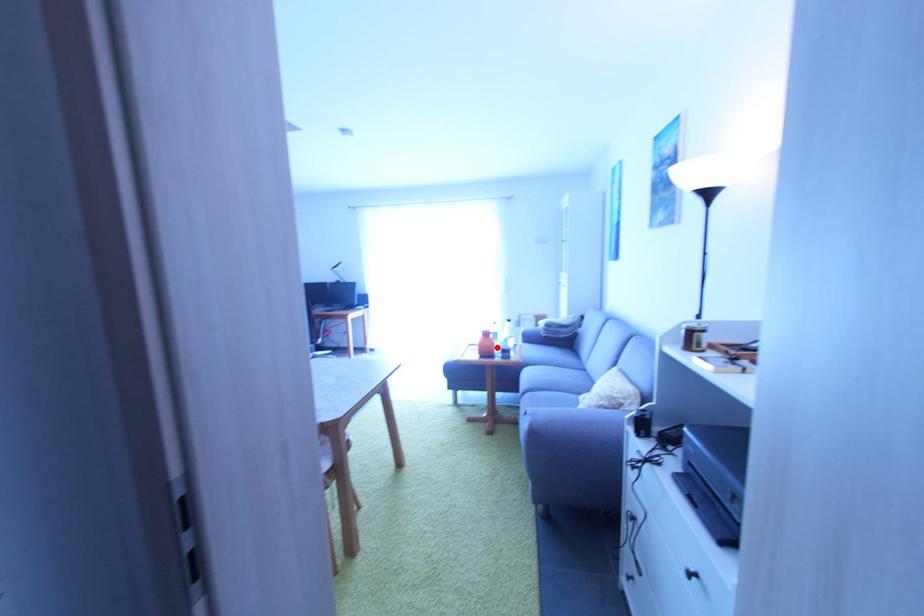
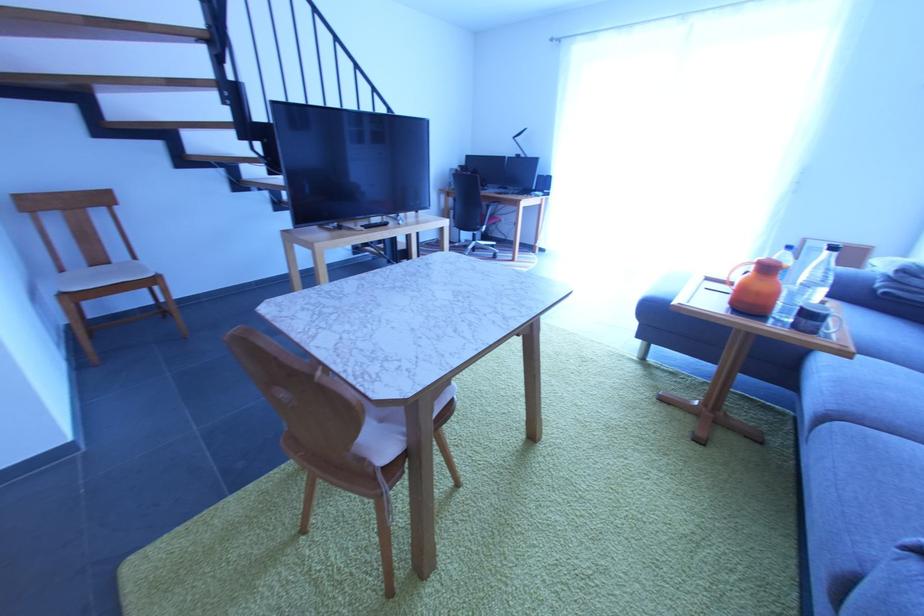
Question: A red point is marked in image1. In image2, is the corresponding 3D point closer to the camera or farther? Reply with the corresponding letter.

Choices:
 (A) The corresponding 3D point is closer.
 (B) The corresponding 3D point is farther.

Answer: (A)